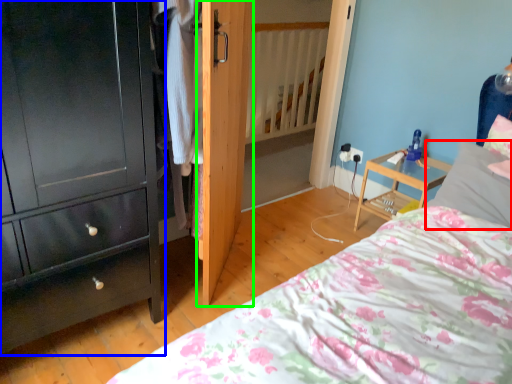
Question: Which object is the farthest from pillow (highlighted by a red box)? Choose among these: chest of drawers (highlighted by a blue box) or door (highlighted by a green box).

Choices:
 (A) chest of drawers
 (B) door

Answer: (A)